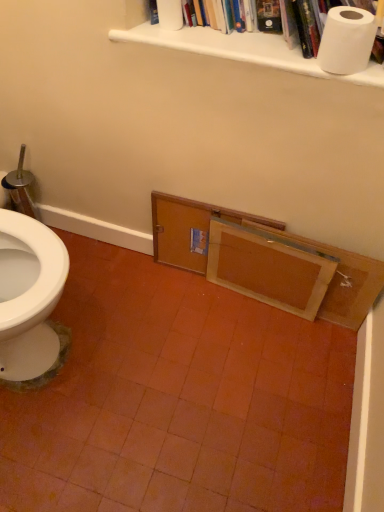
Question: Considering the positions of wooden cabinet at lower right and white matte toilet paper at upper center, marked as the 2th toilet paper in a bottom-to-top arrangement, in the image, is wooden cabinet at lower right wider or thinner than white matte toilet paper at upper center, marked as the 2th toilet paper in a bottom-to-top arrangement,?

Choices:
 (A) thin
 (B) wide

Answer: (A)

Question: Choose the correct answer: Is wooden cabinet at lower right inside white matte toilet paper at upper center, the second toilet paper positioned from the front, or outside it?

Choices:
 (A) inside
 (B) outside

Answer: (B)

Question: Which of these objects is positioned closest to the wooden drawer at lower center, which is counted as the 2th drawer, starting from the right?

Choices:
 (A) white paper towel at upper center
 (B) wooden cabinet at lower right
 (C) wooden drawer at center, the second drawer from the left
 (D) white matte toilet paper at upper center, the second toilet paper positioned from the front
 (E) white matte toilet paper at upper right, placed as the 2th toilet paper when sorted from left to right

Answer: (B)

Question: Estimate the real-world distances between objects in this image. Which object is farther from the white matte toilet paper at upper right, placed as the 2th toilet paper when sorted from left to right?

Choices:
 (A) wooden drawer at lower center, which is counted as the 2th drawer, starting from the right
 (B) wooden cabinet at lower right
 (C) white paper towel at upper center
 (D) wooden drawer at center, which is the 1th drawer from right to left
 (E) white matte toilet paper at upper center, the second toilet paper positioned from the front

Answer: (A)